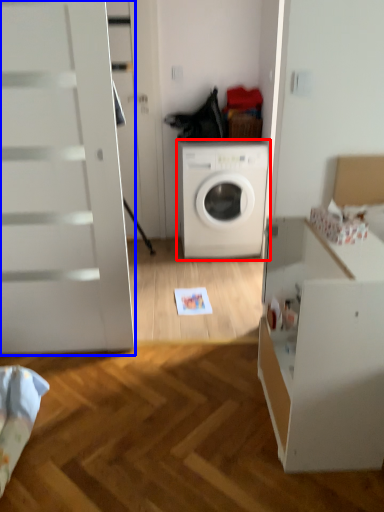
Question: Which object is further to the camera taking this photo, washing machine (highlighted by a red box) or screen door (highlighted by a blue box)?

Choices:
 (A) washing machine
 (B) screen door

Answer: (A)